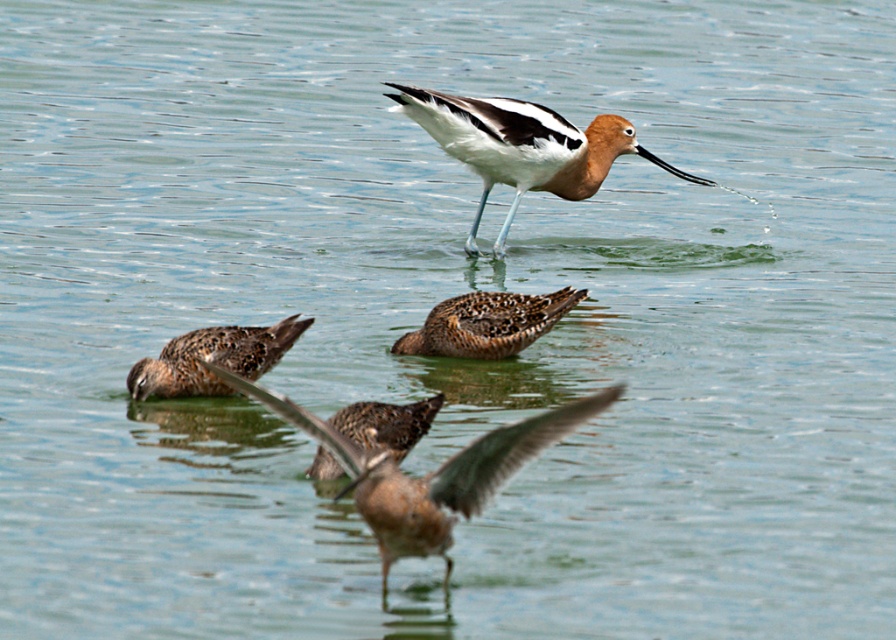
You are a birdwatcher trying to locate the white glossy avocet at upper center in the serene scene. Based on the coordinates provided, can you determine its exact position relative to the center of the image?

The white glossy avocet at upper center is located at point coordinates of 0.230 on the x axis and 0.584 on the y axis, so it is positioned to the left and above the center of the image since the x value is less than 0.5 and the y value is greater than 0.5.

You are a birdwatcher observing the scene. You notice the white glossy avocet at upper center and the brown speckled duck at center. Which bird is positioned to the right when looking at the scene?

The white glossy avocet at upper center is positioned to the right of the brown speckled duck at center.